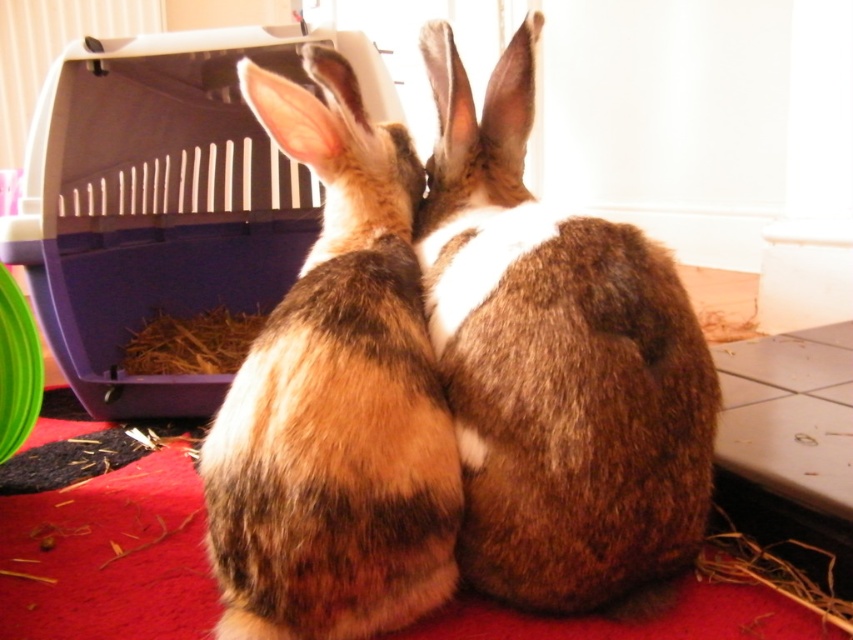
Question: Is brown furry rabbit at center below brown fuzzy rabbit at center?

Choices:
 (A) no
 (B) yes

Answer: (A)

Question: Does brown furry rabbit at center have a larger size compared to brown fuzzy rabbit at center?

Choices:
 (A) yes
 (B) no

Answer: (A)

Question: Among these points, which one is farthest from the camera?

Choices:
 (A) (392, 413)
 (B) (708, 502)

Answer: (B)

Question: Which of the following is the farthest from the observer?

Choices:
 (A) brown fuzzy rabbit at center
 (B) brown furry rabbit at center

Answer: (B)

Question: From the image, what is the correct spatial relationship of brown furry rabbit at center in relation to brown fuzzy rabbit at center?

Choices:
 (A) left
 (B) right

Answer: (B)

Question: Which point appears closest to the camera in this image?

Choices:
 (A) (310, 444)
 (B) (489, 198)

Answer: (A)